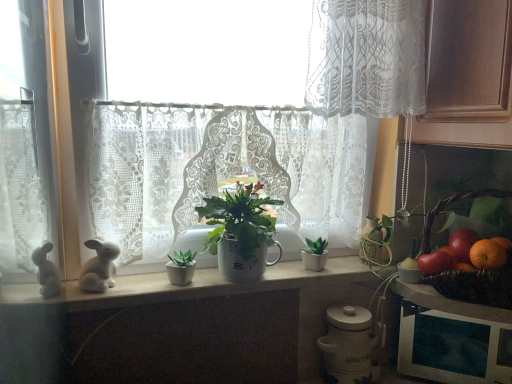
Locate an element on the screen. vacant region to the left of matte white flowerpot at center is located at coordinates (132, 287).